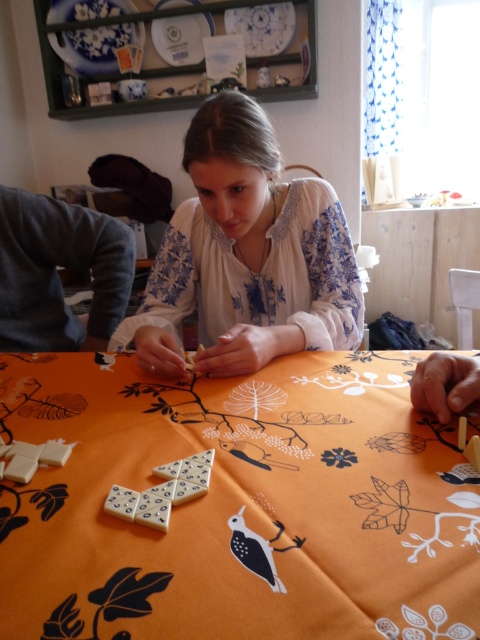
You are a guest at this table and want to place a small vase between the white embroidered blouse at center and the smooth wooden hand at lower right. Based on their heights, which object should the vase be placed closer to?

The white embroidered blouse at center is much taller than the smooth wooden hand at lower right, so the vase should be placed closer to the smooth wooden hand at lower right to ensure stability and balance.

You are sitting at the table and want to place a white matte dominoes at center onto the gray sweater at left. Is the dominoes already positioned behind the sweater?

The white matte dominoes at center is behind gray sweater at left, so yes, the dominoes is already positioned behind the sweater.